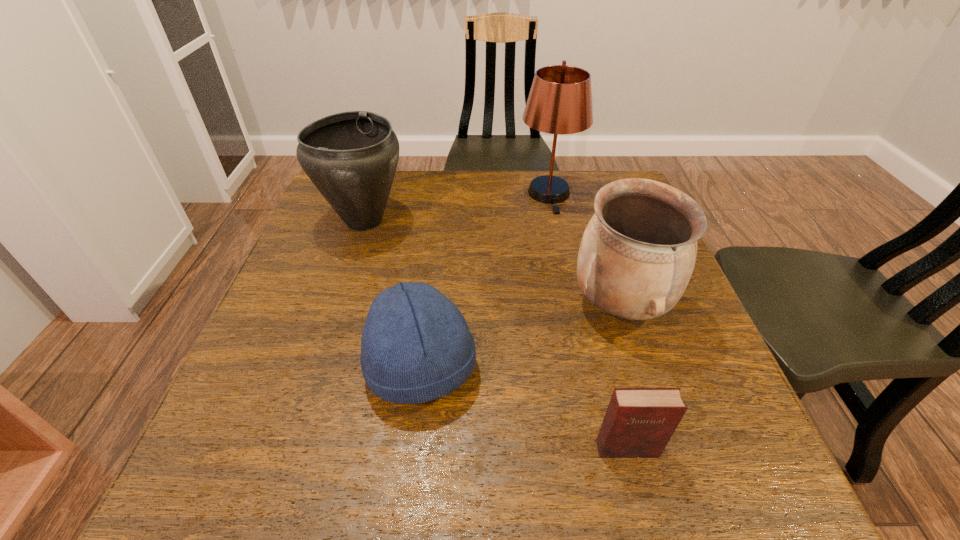
Where is `lampshade`? The height and width of the screenshot is (540, 960). lampshade is located at coordinates (560, 100).

The image size is (960, 540). I want to click on the left urn, so 351,157.

Image resolution: width=960 pixels, height=540 pixels. I want to click on the right urn, so click(637, 254).

Find the location of a particular element. This screenshot has width=960, height=540. skullcap is located at coordinates (416, 346).

At what (x,y) coordinates should I click in order to perform the action: click on diary. Please return your answer as a coordinate pair (x, y). The height and width of the screenshot is (540, 960). Looking at the image, I should click on (639, 422).

The height and width of the screenshot is (540, 960). Identify the location of free space located on the front-facing side of the tallest object. (562, 255).

Where is `vacant space located 0.210m on the front of the left urn`? The width and height of the screenshot is (960, 540). vacant space located 0.210m on the front of the left urn is located at coordinates (334, 314).

At what (x,y) coordinates should I click in order to perform the action: click on free region located on the back of the nearer urn. Please return your answer as a coordinate pair (x, y). The image size is (960, 540). Looking at the image, I should click on (600, 240).

This screenshot has height=540, width=960. Find the location of `vacant space located on the back of the skullcap`. vacant space located on the back of the skullcap is located at coordinates (436, 241).

Image resolution: width=960 pixels, height=540 pixels. In order to click on lampshade present at the far edge in this screenshot , I will do `click(560, 100)`.